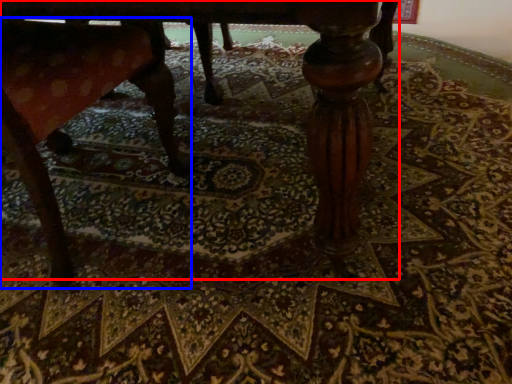
Question: Which point is further to the camera, table (highlighted by a red box) or rocking chair (highlighted by a blue box)?

Choices:
 (A) table
 (B) rocking chair

Answer: (B)